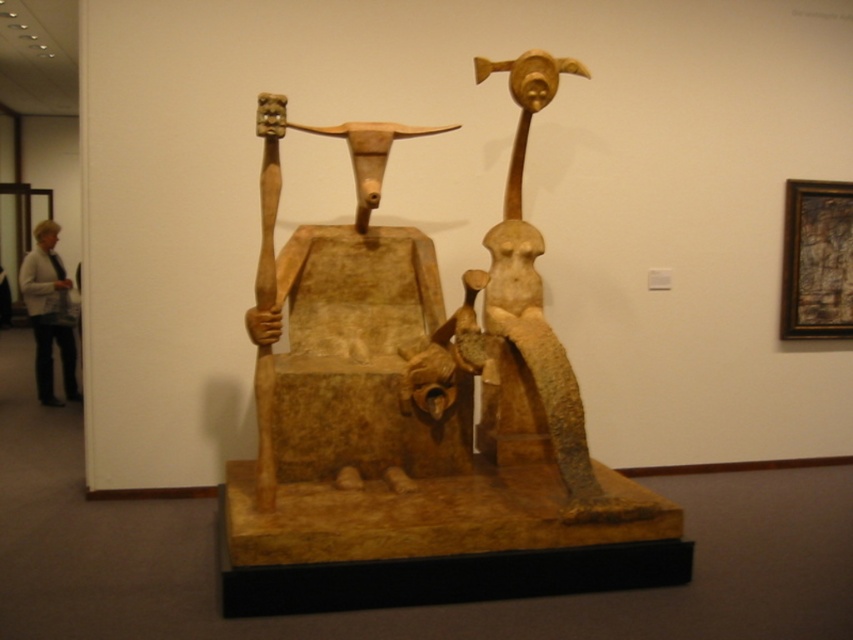
You are an art curator standing in front of the sculpture. You notice the matte wood throne at center and the light beige sweater at left. Which object is positioned to the right of the other?

The matte wood throne at center is to the right of the light beige sweater at left.

You are an art student analyzing the sculpture. The museum has provided coordinates for the central throne. If the coordinate system starts at the bottom left corner of the image, what are the coordinates of the matte wood throne at center?

The coordinates of the matte wood throne at center are at point (357, 337).

Consider the image. What object is located at the coordinates point (357, 337) in the image?

The point (357, 337) corresponds to the matte wood throne at center.